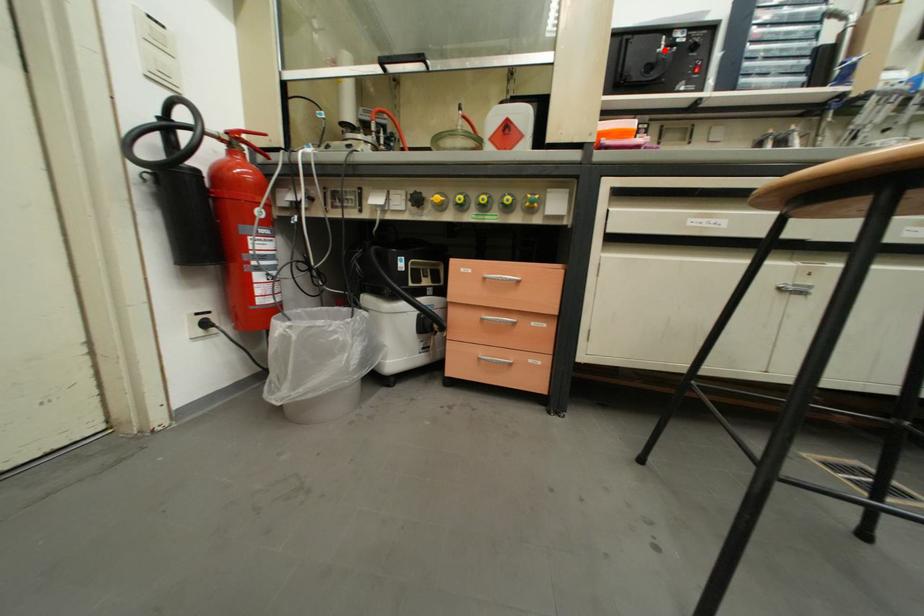
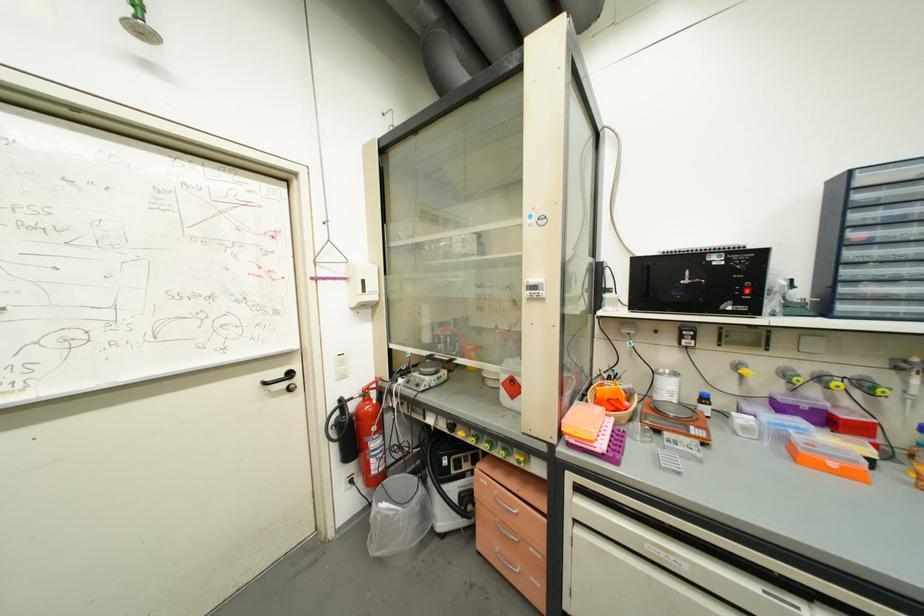
The point at the highlighted location is marked in the first image. Where is the corresponding point in the second image?

(688, 282)